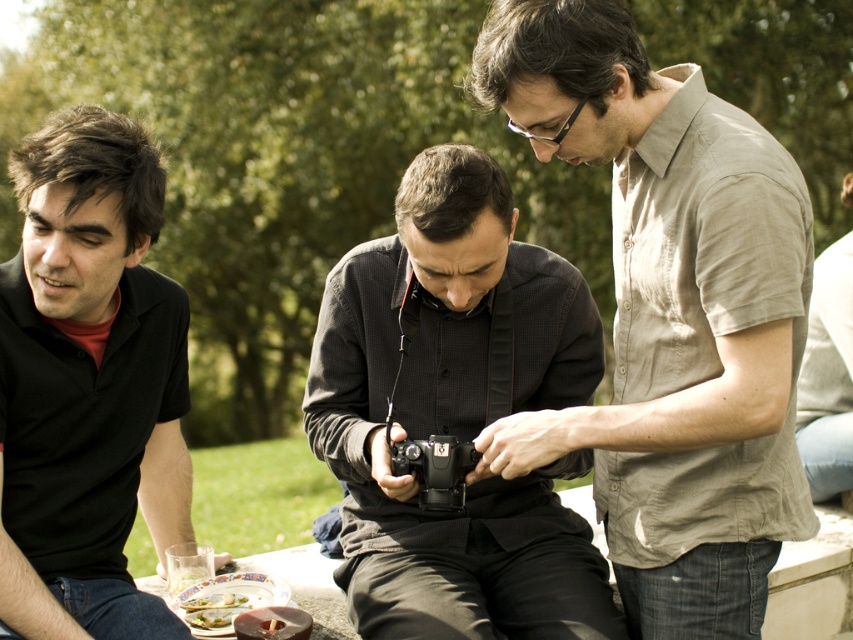
Is point (613, 104) more distant than point (396, 465)?

No, it is in front of (396, 465).

Between light beige cotton shirt at center and black plastic camera at center, which one has more height?

light beige cotton shirt at center

What do you see at coordinates (669, 314) in the screenshot?
I see `light beige cotton shirt at center` at bounding box center [669, 314].

Locate an element on the screen. light beige cotton shirt at center is located at coordinates (669, 314).

Can you confirm if black plastic camera at center is positioned above green leafy vegetable at lower left?

Yes, black plastic camera at center is above green leafy vegetable at lower left.

Can you confirm if black plastic camera at center is positioned to the right of green leafy vegetable at lower left?

Correct, you'll find black plastic camera at center to the right of green leafy vegetable at lower left.

You are a GUI agent. You are given a task and a screenshot of the screen. Output one action in this format:
    pyautogui.click(x=<x>, y=<y>)
    Task: Click on the black plastic camera at center
    Image resolution: width=853 pixels, height=640 pixels.
    Given the screenshot: What is the action you would take?
    pyautogui.click(x=434, y=468)

Between black matte shirt at left and green leafy vegetable at lower left, which one has more height?

black matte shirt at left is taller.

Which is behind, point (115, 230) or point (235, 605)?

The point (235, 605) is behind.

Identify the location of black matte shirt at left. Image resolution: width=853 pixels, height=640 pixels. (88, 381).